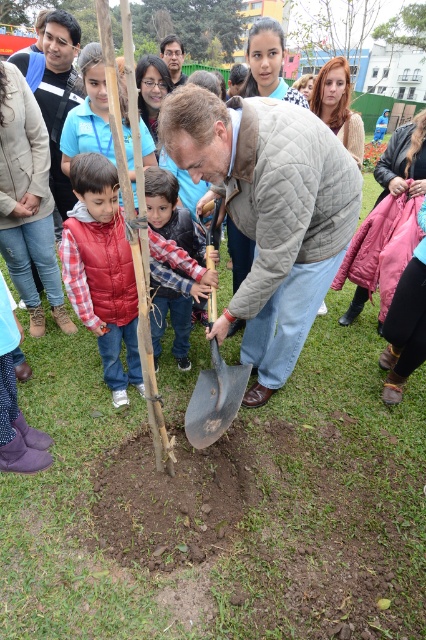
You are standing at point [43,113] and want to walk to the tree being planted. Which direction should you move relative to point [161,272]?

You should move towards point [161,272] because it is in front of your current position at point [43,113], so moving towards it will lead you toward the tree being planted.

You are a photographer at the event and want to capture a photo where the quilted beige jacket at center and the green wood tree at upper center are both visible. Based on their heights, which object will appear smaller in the photo?

The quilted beige jacket at center will appear smaller in the photo since it has a lesser height compared to the green wood tree at upper center.